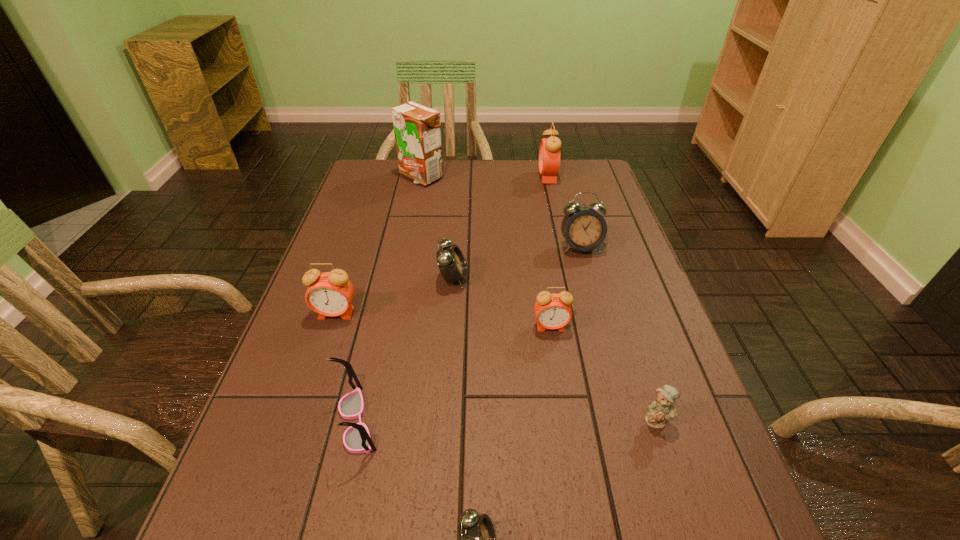
I want to click on object that is at the far left corner, so click(417, 128).

You are a GUI agent. You are given a task and a screenshot of the screen. Output one action in this format:
    pyautogui.click(x=<x>, y=<y>)
    Task: Click on the vacant space at the far edge
    
    Given the screenshot: What is the action you would take?
    pyautogui.click(x=495, y=188)

Image resolution: width=960 pixels, height=540 pixels. I want to click on vacant space at the left edge, so click(334, 365).

In the image, there is a desktop. Where is `free region at the right edge`? Image resolution: width=960 pixels, height=540 pixels. free region at the right edge is located at coordinates (621, 350).

The image size is (960, 540). I want to click on vacant space at the far left corner of the desktop, so click(389, 192).

Identify the location of blank region between the leftmost alarm clock and the teddy bear. (496, 367).

This screenshot has height=540, width=960. In order to click on free area in between the second smallest white alarm clock and the second farthest alarm clock in this screenshot , I will do coord(516,263).

This screenshot has height=540, width=960. Identify the location of vacant region between the teddy bear and the biggest white alarm clock. (619, 333).

This screenshot has width=960, height=540. Identify the location of free space between the teddy bear and the sixth object from left to right. (604, 373).

This screenshot has width=960, height=540. Identify the location of unoccupied area between the sixth object from left to right and the spectacles. (454, 374).